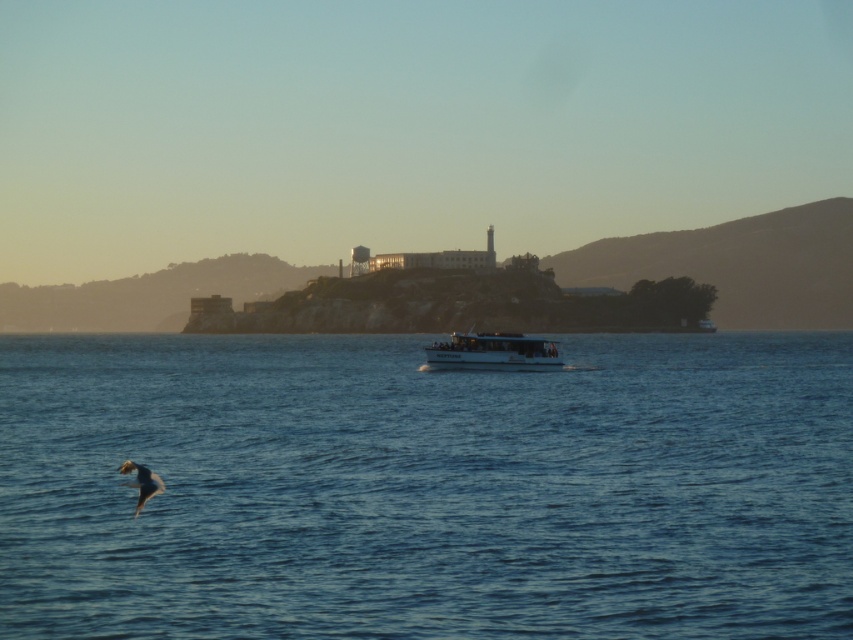
You are a photographer trying to capture the white matte boat at center in your shot. You notice the blue water at center is taking up most of the frame. How can you adjust your camera position to make the boat more prominent?

Since the blue water at center is larger than the white matte boat at center, you can move your camera closer to the boat to reduce the amount of water in the frame and make the boat more prominent.

Based on the photo, you are a photographer trying to capture the white matte boat at center in your shot. You notice the blue water at center is taking up too much space in the frame. What adjustment can you make to ensure the boat is more prominent?

Since the blue water at center has a greater height than the white matte boat at center, you can lower your camera angle to reduce the amount of blue water at center in the frame, making the white matte boat at center more prominent.

You are standing on the shore and see the blue water at center and the white matte boat at center. Which object is located lower in the image?

The blue water at center is positioned under the white matte boat at center, so it is lower in the image.